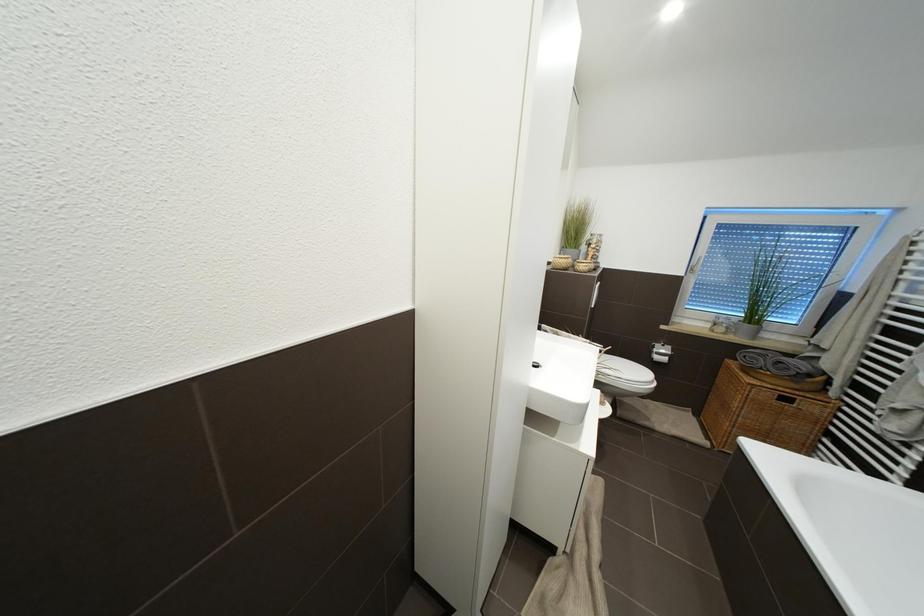
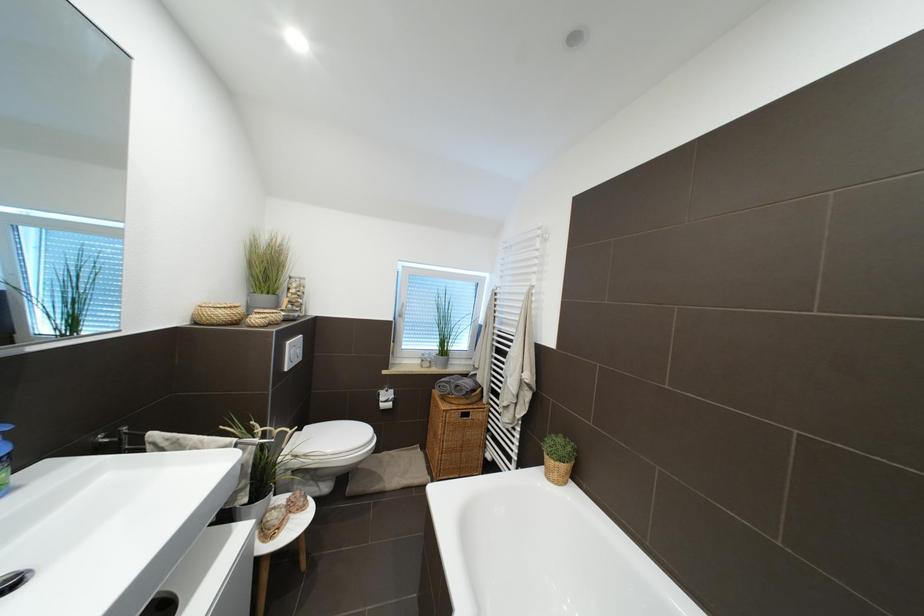
Question: The camera is either moving clockwise (left) or counter-clockwise (right) around the object. The first image is from the beginning of the video and the second image is from the end. Is the camera moving left or right when shooting the video?

Choices:
 (A) Left
 (B) Right

Answer: (A)